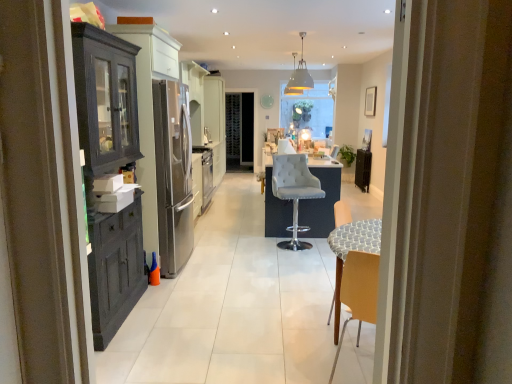
Question: Is metallic pendant light at upper center facing away from gray fabric bar stool at center?

Choices:
 (A) yes
 (B) no

Answer: (B)

Question: Does metallic pendant light at upper center have a smaller size compared to gray fabric bar stool at center?

Choices:
 (A) no
 (B) yes

Answer: (B)

Question: From the image's perspective, is metallic pendant light at upper center located beneath gray fabric bar stool at center?

Choices:
 (A) no
 (B) yes

Answer: (A)

Question: Does metallic pendant light at upper center appear on the right side of gray fabric bar stool at center?

Choices:
 (A) no
 (B) yes

Answer: (B)

Question: From a real-world perspective, is metallic pendant light at upper center beneath gray fabric bar stool at center?

Choices:
 (A) yes
 (B) no

Answer: (B)

Question: Does metallic pendant light at upper center have a greater width compared to gray fabric bar stool at center?

Choices:
 (A) yes
 (B) no

Answer: (B)

Question: Would you say matte dark wood cabinet at left is outside gray fabric bar stool at center?

Choices:
 (A) yes
 (B) no

Answer: (A)

Question: Is matte dark wood cabinet at left oriented towards gray fabric bar stool at center?

Choices:
 (A) no
 (B) yes

Answer: (B)

Question: Is gray fabric bar stool at center located within matte dark wood cabinet at left?

Choices:
 (A) no
 (B) yes

Answer: (A)

Question: Does matte dark wood cabinet at left lie behind gray fabric bar stool at center?

Choices:
 (A) no
 (B) yes

Answer: (A)

Question: Can you confirm if matte dark wood cabinet at left is taller than gray fabric bar stool at center?

Choices:
 (A) yes
 (B) no

Answer: (A)

Question: Does matte dark wood cabinet at left have a smaller size compared to gray fabric bar stool at center?

Choices:
 (A) no
 (B) yes

Answer: (A)

Question: Is gray fabric bar stool at center smaller than black metallic radiator at right?

Choices:
 (A) no
 (B) yes

Answer: (A)